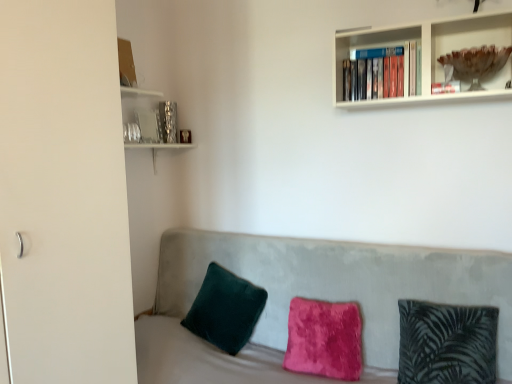
In order to face velvet couch at center, should I rotate leftwards or rightwards?

Rotate right and turn 3.742 degrees.

Describe the element at coordinates (64, 195) in the screenshot. The height and width of the screenshot is (384, 512). I see `white matte glass door at left` at that location.

Measure the distance between fuzzy pink pillow at center, positioned as the 2th pillow in left-to-right order, and camera.

fuzzy pink pillow at center, positioned as the 2th pillow in left-to-right order, is 6.52 feet away from camera.

What are the coordinates of `velvet couch at center` in the screenshot? It's located at (312, 298).

In the scene shown: From the image's perspective, who appears lower, velvet green pillow at right, placed as the 3th pillow when sorted from left to right, or translucent glass bowl at upper right?

velvet green pillow at right, placed as the 3th pillow when sorted from left to right, from the image's perspective.

Considering the relative sizes of velvet green pillow at right, which is the first pillow in right-to-left order, and translucent glass bowl at upper right in the image provided, is velvet green pillow at right, which is the first pillow in right-to-left order, bigger than translucent glass bowl at upper right?

Yes.

Between velvet green pillow at right, which is the first pillow in right-to-left order, and translucent glass bowl at upper right, which one appears on the right side from the viewer's perspective?

translucent glass bowl at upper right.

Choose the correct answer: Is velvet green pillow at right, placed as the 3th pillow when sorted from left to right, inside translucent glass bowl at upper right or outside it?

velvet green pillow at right, placed as the 3th pillow when sorted from left to right, is spatially situated outside translucent glass bowl at upper right.

Is velvet green pillow at right, placed as the 3th pillow when sorted from left to right, at the right side of white matte glass door at left?

Indeed, velvet green pillow at right, placed as the 3th pillow when sorted from left to right, is positioned on the right side of white matte glass door at left.

Which object is further away from the camera taking this photo, velvet green pillow at right, which is the first pillow in right-to-left order, or white matte glass door at left?

velvet green pillow at right, which is the first pillow in right-to-left order.

Considering the relative sizes of velvet green pillow at right, which is the first pillow in right-to-left order, and white matte glass door at left in the image provided, is velvet green pillow at right, which is the first pillow in right-to-left order, smaller than white matte glass door at left?

Yes, velvet green pillow at right, which is the first pillow in right-to-left order, is smaller than white matte glass door at left.

Is velvet green pillow at right, placed as the 3th pillow when sorted from left to right, facing towards white matte glass door at left?

No, velvet green pillow at right, placed as the 3th pillow when sorted from left to right, is not oriented towards white matte glass door at left.

Who is more distant, white matte glass door at left or fuzzy pink pillow at center, the second pillow from the right?

fuzzy pink pillow at center, the second pillow from the right, is behind.

Is point (72, 289) behind point (358, 314)?

No, (72, 289) is closer to viewer.

From the image's perspective, does white matte glass door at left appear lower than fuzzy pink pillow at center, positioned as the 2th pillow in left-to-right order?

No, from the image's perspective, white matte glass door at left is not beneath fuzzy pink pillow at center, positioned as the 2th pillow in left-to-right order.

Is white matte glass door at left in contact with fuzzy pink pillow at center, the second pillow from the right?

No.

Between translucent glass bowl at upper right and velvet couch at center, which one has larger width?

With larger width is velvet couch at center.

Based on the photo, based on their positions, is translucent glass bowl at upper right located to the left or right of velvet couch at center?

translucent glass bowl at upper right is positioned on velvet couch at center's right side.

From a real-world perspective, is translucent glass bowl at upper right positioned under velvet couch at center based on gravity?

No, from a real-world perspective, translucent glass bowl at upper right is not beneath velvet couch at center.

How different are the orientations of fuzzy pink pillow at center, positioned as the 2th pillow in left-to-right order, and white matte glass door at left in degrees?

The facing directions of fuzzy pink pillow at center, positioned as the 2th pillow in left-to-right order, and white matte glass door at left are 94.4 degrees apart.

Is fuzzy pink pillow at center, positioned as the 2th pillow in left-to-right order, aimed at white matte glass door at left?

No, fuzzy pink pillow at center, positioned as the 2th pillow in left-to-right order, is not oriented towards white matte glass door at left.

Considering the relative sizes of fuzzy pink pillow at center, the second pillow from the right, and white matte glass door at left in the image provided, is fuzzy pink pillow at center, the second pillow from the right, thinner than white matte glass door at left?

Indeed, fuzzy pink pillow at center, the second pillow from the right, has a lesser width compared to white matte glass door at left.

Is fuzzy pink pillow at center, positioned as the 2th pillow in left-to-right order, inside the boundaries of white matte glass door at left, or outside?

fuzzy pink pillow at center, positioned as the 2th pillow in left-to-right order, cannot be found inside white matte glass door at left.

Considering the relative positions of white matte glass door at left and translucent glass bowl at upper right in the image provided, is white matte glass door at left to the left of translucent glass bowl at upper right from the viewer's perspective?

Yes.

Does white matte glass door at left lie behind translucent glass bowl at upper right?

No, white matte glass door at left is closer to the viewer.

From the image's perspective, is white matte glass door at left under translucent glass bowl at upper right?

Indeed, from the image's perspective, white matte glass door at left is shown beneath translucent glass bowl at upper right.

From a real-world perspective, is velvet green pillow at right, which is the first pillow in right-to-left order, physically below fuzzy pink pillow at center, the second pillow from the right?

Actually, velvet green pillow at right, which is the first pillow in right-to-left order, is physically above fuzzy pink pillow at center, the second pillow from the right, in the real world.

Considering the positions of points (448, 369) and (321, 334), is point (448, 369) farther from camera compared to point (321, 334)?

No, it is not.

Is velvet green pillow at right, which is the first pillow in right-to-left order, with fuzzy pink pillow at center, the second pillow from the right?

velvet green pillow at right, which is the first pillow in right-to-left order, and fuzzy pink pillow at center, the second pillow from the right, are not in contact.

Looking at this image, is velvet green pillow at right, which is the first pillow in right-to-left order, smaller than fuzzy pink pillow at center, positioned as the 2th pillow in left-to-right order?

No, velvet green pillow at right, which is the first pillow in right-to-left order, is not smaller than fuzzy pink pillow at center, positioned as the 2th pillow in left-to-right order.

This screenshot has height=384, width=512. Find the location of `shelf located above the velvet green pillow at right, which is the first pillow in right-to-left order (from the image's perspective)`. shelf located above the velvet green pillow at right, which is the first pillow in right-to-left order (from the image's perspective) is located at coordinates (468, 35).

Image resolution: width=512 pixels, height=384 pixels. There is a velvet green pillow at right, which is the first pillow in right-to-left order. What are the coordinates of `glass door above it (from a real-world perspective)` in the screenshot? It's located at 64,195.

Based on their spatial positions, is velvet couch at center or velvet green pillow at right, placed as the 3th pillow when sorted from left to right, closer to translucent glass bowl at upper right?

velvet green pillow at right, placed as the 3th pillow when sorted from left to right, is positioned closer to the anchor translucent glass bowl at upper right.

Which object lies further to the anchor point velvet couch at center, white matte glass door at left or fuzzy pink pillow at center, the second pillow from the right?

white matte glass door at left is further to velvet couch at center.

Estimate the real-world distances between objects in this image. Which object is further from velvet couch at center, fuzzy pink pillow at center, the second pillow from the right, or translucent glass bowl at upper right?

translucent glass bowl at upper right is positioned further to the anchor velvet couch at center.

Looking at the image, which one is located further to velvet green pillow at right, placed as the 3th pillow when sorted from left to right, velvet couch at center or translucent glass bowl at upper right?

translucent glass bowl at upper right is further to velvet green pillow at right, placed as the 3th pillow when sorted from left to right.

Looking at the image, which one is located further to velvet green pillow at right, placed as the 3th pillow when sorted from left to right, translucent glass bowl at upper right or white matte glass door at left?

white matte glass door at left is positioned further to the anchor velvet green pillow at right, placed as the 3th pillow when sorted from left to right.

Looking at the image, which one is located further to velvet green pillow at left, placed as the first pillow when sorted from left to right, translucent glass bowl at upper right or velvet green pillow at right, placed as the 3th pillow when sorted from left to right?

translucent glass bowl at upper right is positioned further to the anchor velvet green pillow at left, placed as the first pillow when sorted from left to right.

Considering their positions, is fuzzy pink pillow at center, positioned as the 2th pillow in left-to-right order, positioned further to velvet green pillow at right, placed as the 3th pillow when sorted from left to right, than white matte glass door at left?

Based on the image, white matte glass door at left appears to be further to velvet green pillow at right, placed as the 3th pillow when sorted from left to right.

Which object lies further to the anchor point velvet couch at center, white matte glass door at left or translucent glass bowl at upper right?

translucent glass bowl at upper right.

Identify the location of studio couch located between white matte glass door at left and fuzzy pink pillow at center, positioned as the 2th pillow in left-to-right order, in the left-right direction. The width and height of the screenshot is (512, 384). (312, 298).

At what (x,y) coordinates should I click in order to perform the action: click on pillow that lies between translucent glass bowl at upper right and velvet green pillow at right, placed as the 3th pillow when sorted from left to right, from top to bottom. Please return your answer as a coordinate pair (x, y). Looking at the image, I should click on (225, 309).

You are a GUI agent. You are given a task and a screenshot of the screen. Output one action in this format:
    pyautogui.click(x=<x>, y=<y>)
    Task: Click on the pillow situated between velvet green pillow at left, which appears as the 3th pillow when viewed from the right, and velvet green pillow at right, which is the first pillow in right-to-left order, from left to right
    This screenshot has height=384, width=512.
    Given the screenshot: What is the action you would take?
    pyautogui.click(x=324, y=339)

At what (x,y) coordinates should I click in order to perform the action: click on studio couch between white matte glass door at left and velvet green pillow at left, which appears as the 3th pillow when viewed from the right, in the front-back direction. Please return your answer as a coordinate pair (x, y). This screenshot has width=512, height=384. Looking at the image, I should click on coord(312,298).